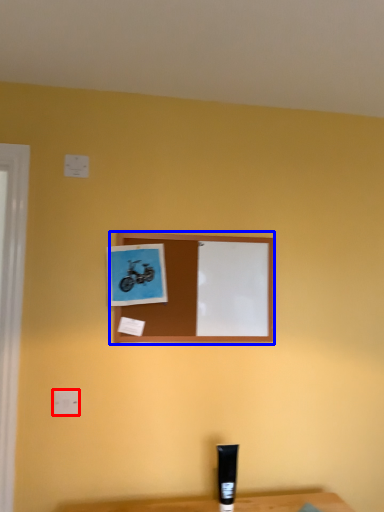
Question: Among these objects, which one is nearest to the camera, electric outlet (highlighted by a red box) or picture frame (highlighted by a blue box)?

Choices:
 (A) electric outlet
 (B) picture frame

Answer: (A)